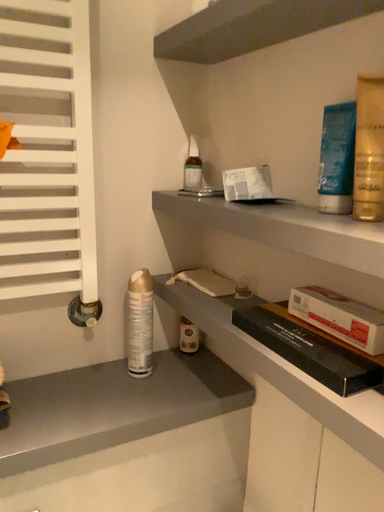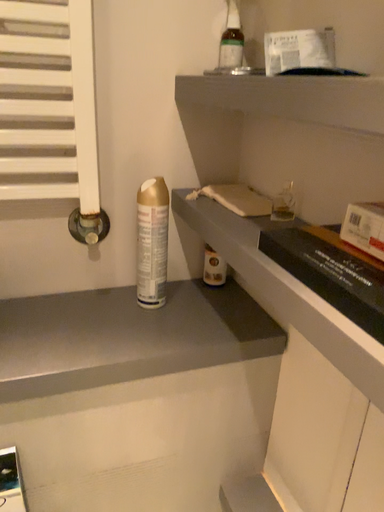
Question: How did the camera likely rotate when shooting the video?

Choices:
 (A) rotated right
 (B) rotated left

Answer: (B)